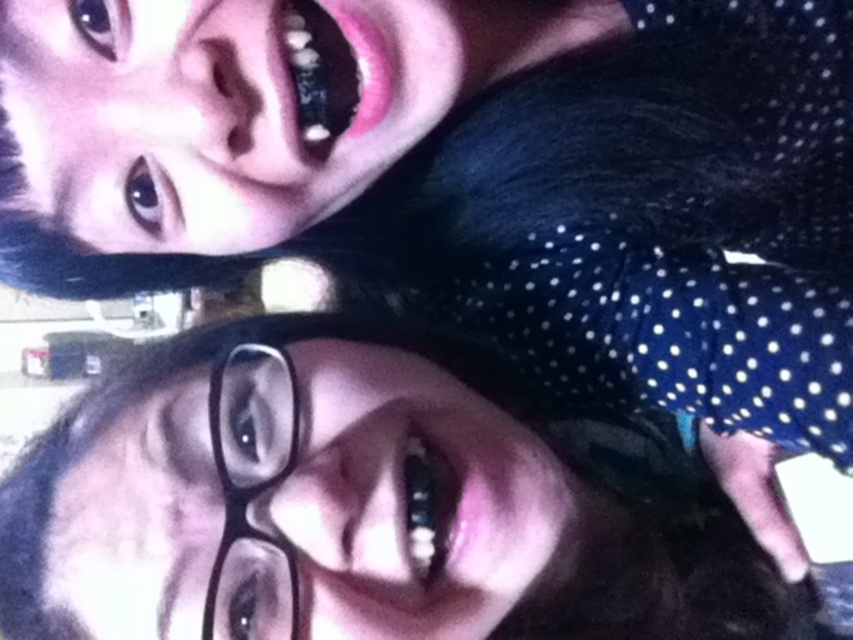
You are taking a selfie with your black matte glasses at center. To ensure the best photo quality, you want to be exactly 50 centimeters away from the camera. Are you currently too close or too far?

The black matte glasses at center and camera are 52.34 centimeters apart from each other, which means you are currently too far by 2.34 centimeters.

You are trying to decide which pair of glasses to wear for a casual day out. You see both the black matte glasses at center and the black plastic glasses at lower left in the photo. Based on their positions in the image, which pair is closer to the bottom of the frame?

Answer: The black matte glasses at center is below black plastic glasses at lower left, so the black matte glasses at center is closer to the bottom of the frame.